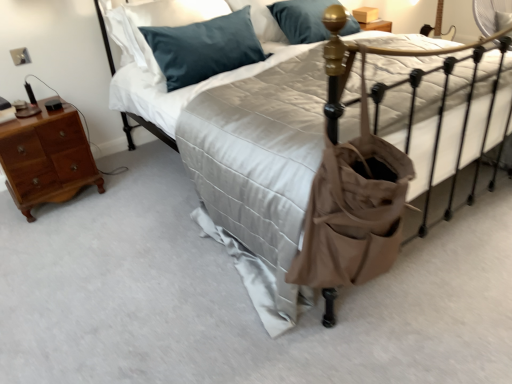
Question: From a real-world perspective, is satin blue pillow at upper center, arranged as the first pillow when viewed from the front, above or below light brown wood nightstand at left?

Choices:
 (A) above
 (B) below

Answer: (A)

Question: In terms of width, does satin blue pillow at upper center, arranged as the first pillow when viewed from the front, look wider or thinner when compared to light brown wood nightstand at left?

Choices:
 (A) wide
 (B) thin

Answer: (A)

Question: Which is farther from the matte beige bed at center?

Choices:
 (A) matte brown tote at center
 (B) teal fabric pillow at upper left, the second pillow viewed from the front
 (C) satin blue pillow at upper center, placed as the second pillow when sorted from back to front
 (D) light brown wood nightstand at left

Answer: (D)

Question: Based on their relative distances, which object is farther from the matte brown tote at center?

Choices:
 (A) satin blue pillow at upper center, placed as the second pillow when sorted from back to front
 (B) matte beige bed at center
 (C) light brown wood nightstand at left
 (D) teal fabric pillow at upper left, placed as the 1th pillow when sorted from back to front

Answer: (C)